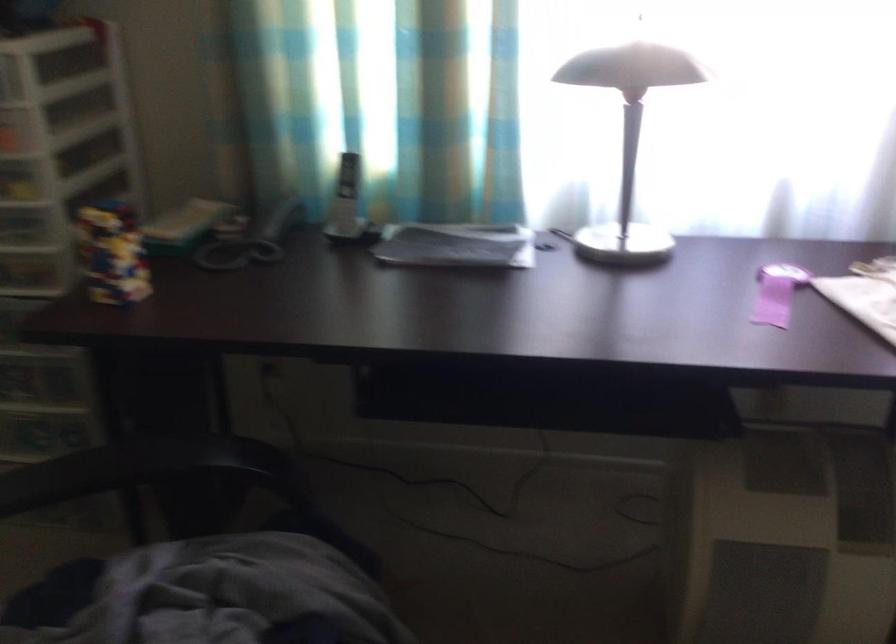
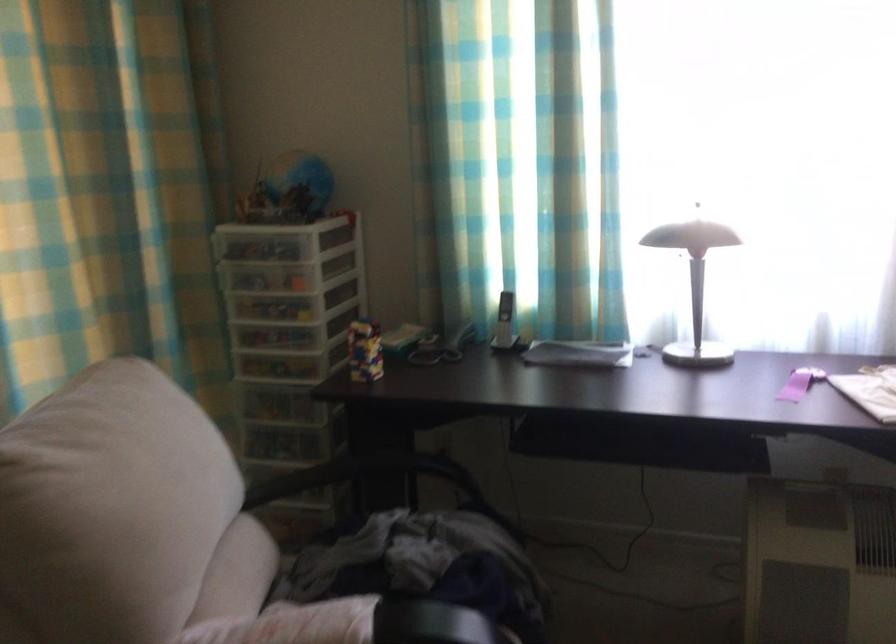
The point at (346, 201) is marked in the first image. Where is the corresponding point in the second image?

(504, 322)